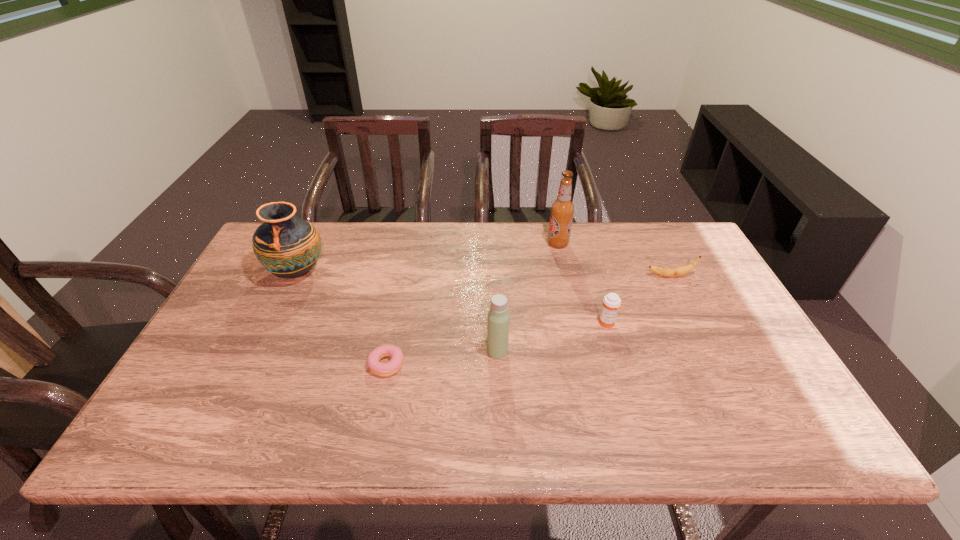
Where is `the farthest object`? Image resolution: width=960 pixels, height=540 pixels. the farthest object is located at coordinates click(562, 209).

You are a GUI agent. You are given a task and a screenshot of the screen. Output one action in this format:
    pyautogui.click(x=<x>, y=<y>)
    Task: Click on the fourth object from left to right
    The height and width of the screenshot is (540, 960).
    Given the screenshot: What is the action you would take?
    pyautogui.click(x=562, y=209)

This screenshot has width=960, height=540. What are the coordinates of `pottery` in the screenshot? It's located at (286, 246).

Where is `the third tallest object`? Image resolution: width=960 pixels, height=540 pixels. the third tallest object is located at coordinates (498, 321).

The width and height of the screenshot is (960, 540). I want to click on the fourth object from right to left, so click(498, 321).

At what (x,y) coordinates should I click in order to perform the action: click on the fifth object from left to right. Please return your answer as a coordinate pair (x, y). Looking at the image, I should click on (611, 303).

I want to click on the fourth tallest object, so click(x=611, y=303).

Locate an element on the screen. the rightmost object is located at coordinates (667, 272).

Identify the location of banana. (667, 272).

Locate an element on the screen. This screenshot has height=540, width=960. doughnut is located at coordinates (381, 369).